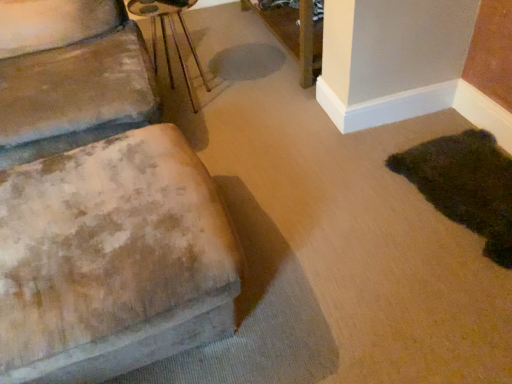
Question: From the image's perspective, is metallic silver side table at upper center on top of worn fabric ottoman at left?

Choices:
 (A) no
 (B) yes

Answer: (B)

Question: Is metallic silver side table at upper center oriented towards worn fabric ottoman at left?

Choices:
 (A) no
 (B) yes

Answer: (A)

Question: Can you confirm if metallic silver side table at upper center is wider than worn fabric ottoman at left?

Choices:
 (A) no
 (B) yes

Answer: (A)

Question: Is metallic silver side table at upper center at the right side of worn fabric ottoman at left?

Choices:
 (A) yes
 (B) no

Answer: (A)

Question: Considering the relative sizes of metallic silver side table at upper center and worn fabric ottoman at left in the image provided, is metallic silver side table at upper center bigger than worn fabric ottoman at left?

Choices:
 (A) no
 (B) yes

Answer: (A)

Question: In terms of height, does wooden table at upper center look taller or shorter compared to dark green plush rug at lower right?

Choices:
 (A) tall
 (B) short

Answer: (A)

Question: From the image's perspective, is wooden table at upper center positioned above or below dark green plush rug at lower right?

Choices:
 (A) above
 (B) below

Answer: (A)

Question: Does point (282, 4) appear closer or farther from the camera than point (481, 134)?

Choices:
 (A) farther
 (B) closer

Answer: (A)

Question: Relative to dark green plush rug at lower right, is wooden table at upper center in front or behind?

Choices:
 (A) front
 (B) behind

Answer: (B)

Question: Looking at the image, does dark green plush rug at lower right seem bigger or smaller compared to wooden table at upper center?

Choices:
 (A) big
 (B) small

Answer: (B)

Question: Is point (465, 147) closer or farther from the camera than point (291, 13)?

Choices:
 (A) farther
 (B) closer

Answer: (B)

Question: Is dark green plush rug at lower right spatially inside wooden table at upper center, or outside of it?

Choices:
 (A) inside
 (B) outside

Answer: (B)

Question: From the image's perspective, relative to wooden table at upper center, is dark green plush rug at lower right above or below?

Choices:
 (A) above
 (B) below

Answer: (B)

Question: Looking at the image, does metallic silver side table at upper center seem bigger or smaller compared to dark green plush rug at lower right?

Choices:
 (A) small
 (B) big

Answer: (B)

Question: Considering the positions of point (138, 4) and point (454, 175), is point (138, 4) closer or farther from the camera than point (454, 175)?

Choices:
 (A) farther
 (B) closer

Answer: (A)